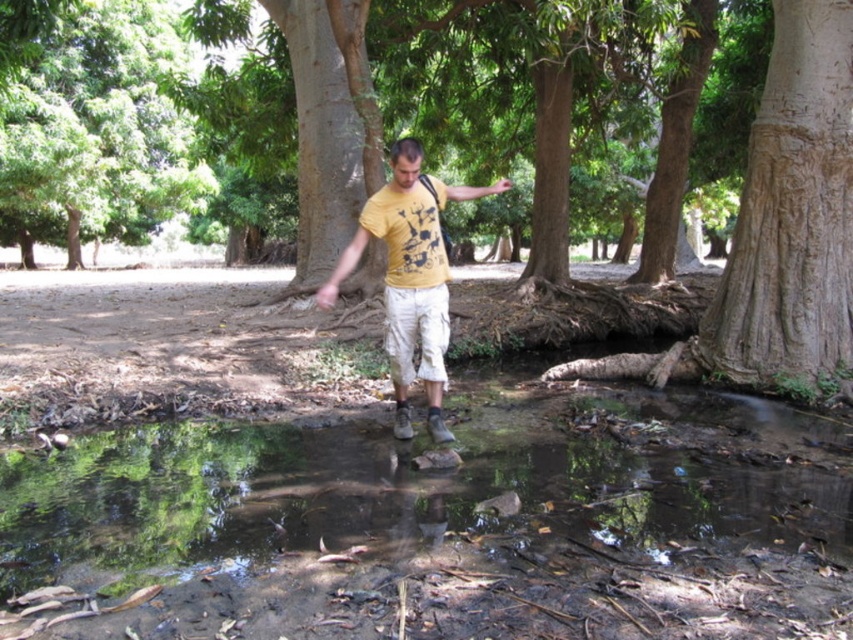
Question: Is clear water at center to the right of brown rough tree at center from the viewer's perspective?

Choices:
 (A) yes
 (B) no

Answer: (B)

Question: Which object is the farthest from the yellow matte t-shirt at center?

Choices:
 (A) clear water at center
 (B) green leafy tree at upper left
 (C) brown rough tree at center

Answer: (B)

Question: Among these objects, which one is nearest to the camera?

Choices:
 (A) clear water at center
 (B) yellow matte t-shirt at center
 (C) green leafy tree at upper left

Answer: (A)

Question: Is clear water at center positioned before brown rough tree at center?

Choices:
 (A) yes
 (B) no

Answer: (A)

Question: Can you confirm if clear water at center is positioned to the right of green leafy tree at upper left?

Choices:
 (A) no
 (B) yes

Answer: (B)

Question: Which object is the closest to the brown rough tree at center?

Choices:
 (A) clear water at center
 (B) green leafy tree at upper left
 (C) yellow matte t-shirt at center

Answer: (C)